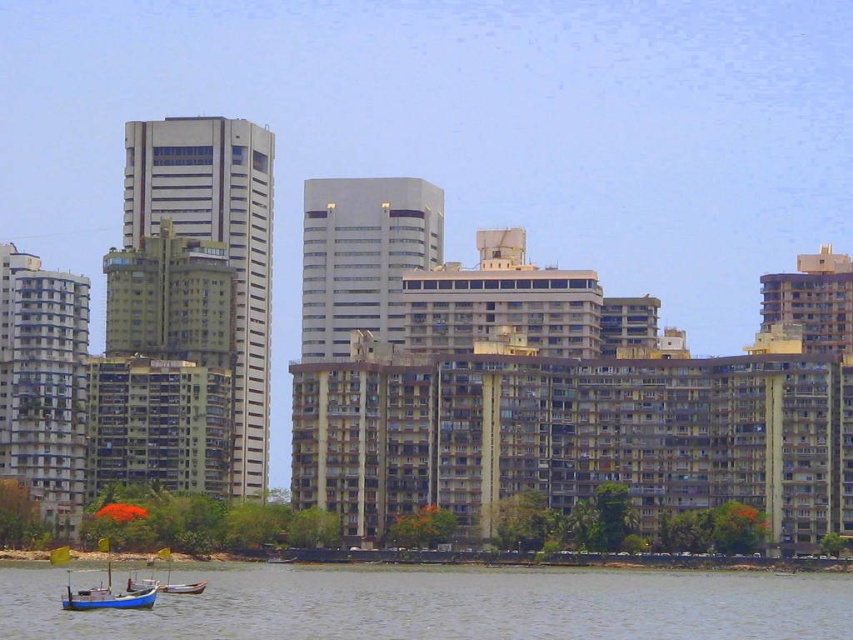
You are a delivery drone that needs to land on the greenish water at lower left. The blue wooden boat at lower left is nearby. Is there enough space for you to land safely if you require 20 meters of clearance?

The distance between the greenish water at lower left and the blue wooden boat at lower left is 18.60 meters. Since you need 20 meters of clearance, there is not enough space to land safely.